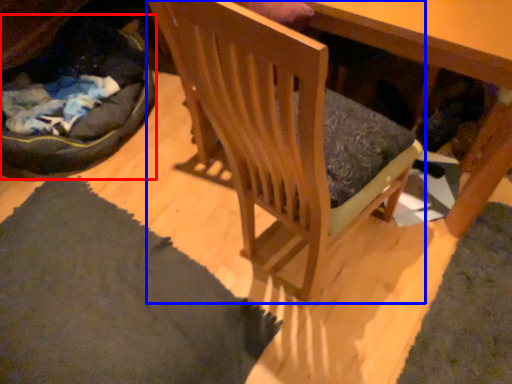
Question: Which object appears closest to the camera in this image, cat bed (highlighted by a red box) or chair (highlighted by a blue box)?

Choices:
 (A) cat bed
 (B) chair

Answer: (B)